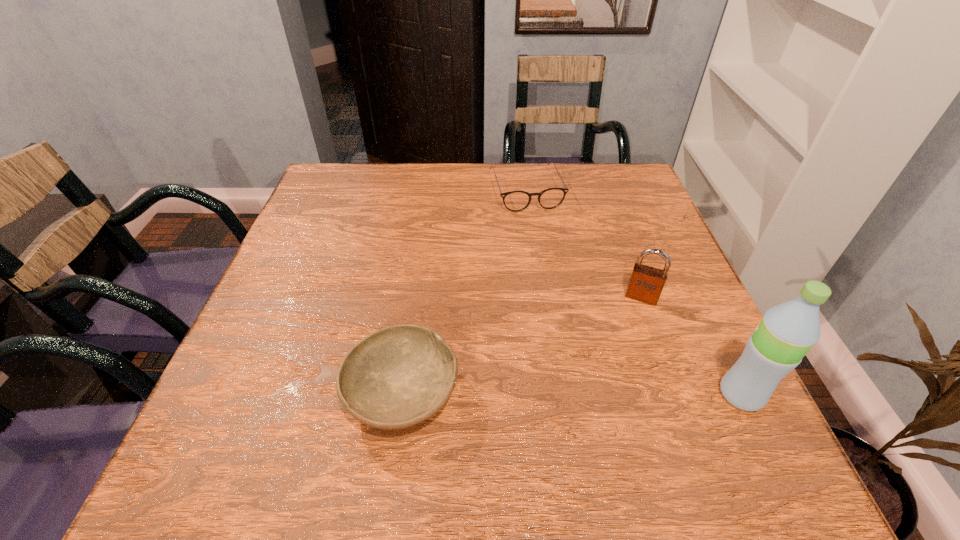
Identify the location of the third tallest object. (397, 377).

This screenshot has height=540, width=960. I want to click on the leftmost object, so click(x=397, y=377).

Locate an element on the screen. The image size is (960, 540). the tallest object is located at coordinates (787, 331).

At what (x,y) coordinates should I click in order to perform the action: click on the rightmost object. Please return your answer as a coordinate pair (x, y). The height and width of the screenshot is (540, 960). Looking at the image, I should click on (787, 331).

Locate an element on the screen. This screenshot has height=540, width=960. padlock is located at coordinates (646, 283).

Find the location of a particular element. The height and width of the screenshot is (540, 960). the third nearest object is located at coordinates (646, 283).

Identify the location of the second object from left to right. This screenshot has width=960, height=540. (515, 201).

Where is `spectacles`? spectacles is located at coordinates (515, 201).

At what (x,y) coordinates should I click in order to perform the action: click on vacant area situated on the left of the bowl. Please return your answer as a coordinate pair (x, y). The image size is (960, 540). Looking at the image, I should click on (277, 394).

This screenshot has height=540, width=960. I want to click on free space located on the back of the rightmost object, so click(x=709, y=329).